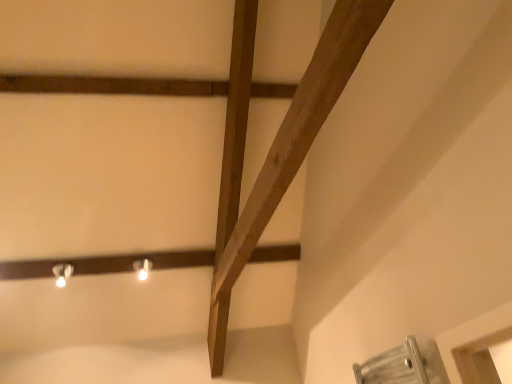
Question: Would you say matte white bulb at upper center, the 1th light fixture from the right, is to the left or to the right of white glossy light fixture at upper left, the 1th light fixture positioned from the left, in the picture?

Choices:
 (A) left
 (B) right

Answer: (B)

Question: Is point (140, 273) closer or farther from the camera than point (64, 276)?

Choices:
 (A) closer
 (B) farther

Answer: (B)

Question: From a real-world perspective, is matte white bulb at upper center, positioned as the second light fixture in left-to-right order, physically located above or below white glossy light fixture at upper left, the 1th light fixture positioned from the left?

Choices:
 (A) below
 (B) above

Answer: (A)

Question: From the image's perspective, is white glossy light fixture at upper left, the 1th light fixture positioned from the left, positioned above or below matte white bulb at upper center, positioned as the second light fixture in left-to-right order?

Choices:
 (A) above
 (B) below

Answer: (B)

Question: Would you say white glossy light fixture at upper left, which is the 2th light fixture from right to left, is to the left or to the right of matte white bulb at upper center, positioned as the second light fixture in left-to-right order, in the picture?

Choices:
 (A) right
 (B) left

Answer: (B)

Question: Considering the positions of point (55, 269) and point (136, 261), is point (55, 269) closer or farther from the camera than point (136, 261)?

Choices:
 (A) farther
 (B) closer

Answer: (B)

Question: In terms of width, does white glossy light fixture at upper left, the 1th light fixture positioned from the left, look wider or thinner when compared to matte white bulb at upper center, positioned as the second light fixture in left-to-right order?

Choices:
 (A) thin
 (B) wide

Answer: (B)